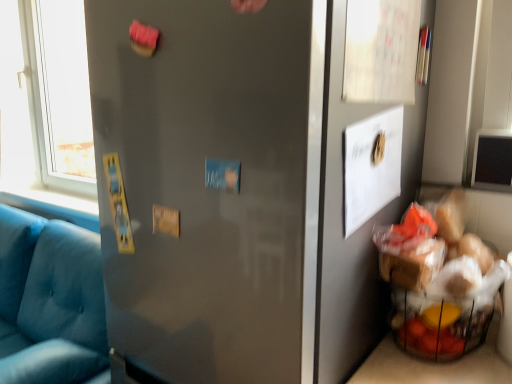
Question: Does point (240, 173) appear closer or farther from the camera than point (60, 256)?

Choices:
 (A) closer
 (B) farther

Answer: (A)

Question: From the image's perspective, is matte gray door at upper left located above or below matte blue fabric couch at left?

Choices:
 (A) above
 (B) below

Answer: (A)

Question: Is matte gray door at upper left to the left or to the right of matte blue fabric couch at left in the image?

Choices:
 (A) left
 (B) right

Answer: (B)

Question: Does point (26, 302) appear closer or farther from the camera than point (257, 294)?

Choices:
 (A) farther
 (B) closer

Answer: (A)

Question: Considering the relative positions of matte blue fabric couch at left and matte gray door at upper left in the image provided, is matte blue fabric couch at left to the left or to the right of matte gray door at upper left?

Choices:
 (A) right
 (B) left

Answer: (B)

Question: Based on their sizes in the image, would you say matte blue fabric couch at left is bigger or smaller than matte gray door at upper left?

Choices:
 (A) small
 (B) big

Answer: (B)

Question: From the image's perspective, relative to matte gray door at upper left, is matte blue fabric couch at left above or below?

Choices:
 (A) below
 (B) above

Answer: (A)